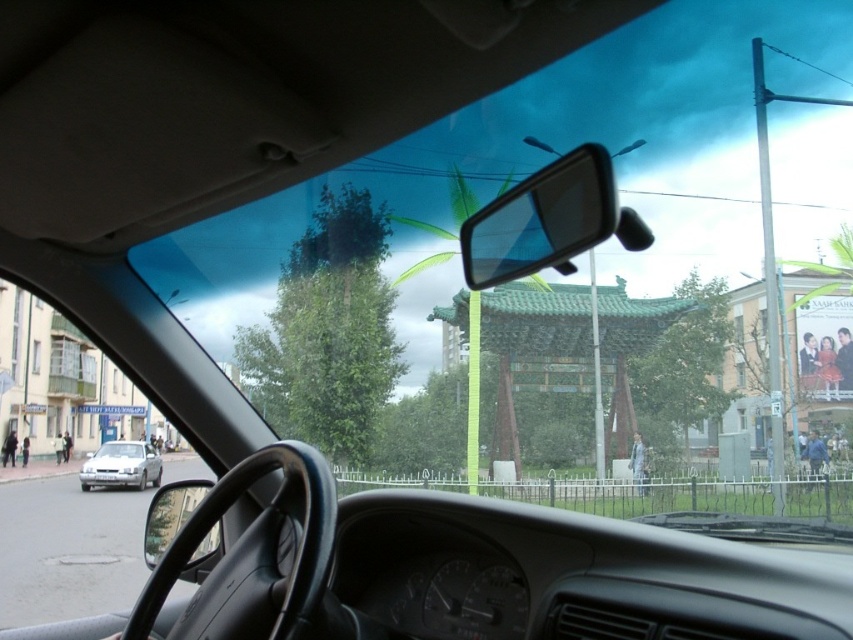
Question: Is clear plastic mirror at upper center bigger than silver metallic sedan at lower left?

Choices:
 (A) yes
 (B) no

Answer: (B)

Question: Is clear plastic mirror at upper center closer to the viewer compared to silver metallic sedan at lower left?

Choices:
 (A) no
 (B) yes

Answer: (B)

Question: Which object appears closest to the camera in this image?

Choices:
 (A) silver metallic sedan at lower left
 (B) clear plastic mirror at upper center

Answer: (B)

Question: Which object is farther from the camera taking this photo?

Choices:
 (A) clear plastic mirror at upper center
 (B) silver metallic sedan at lower left

Answer: (B)

Question: Is clear plastic mirror at upper center wider than silver metallic sedan at lower left?

Choices:
 (A) yes
 (B) no

Answer: (B)